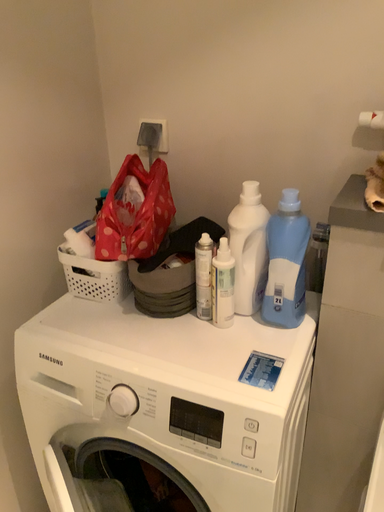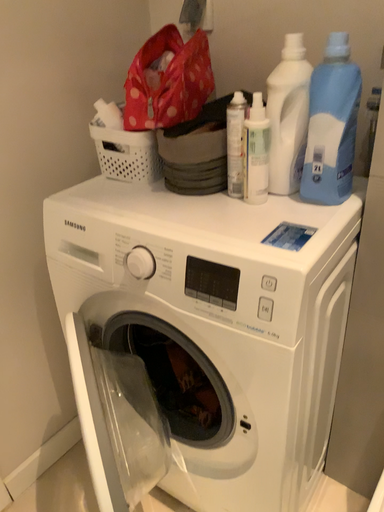
Question: Which way did the camera rotate in the video?

Choices:
 (A) rotated left
 (B) rotated right

Answer: (A)